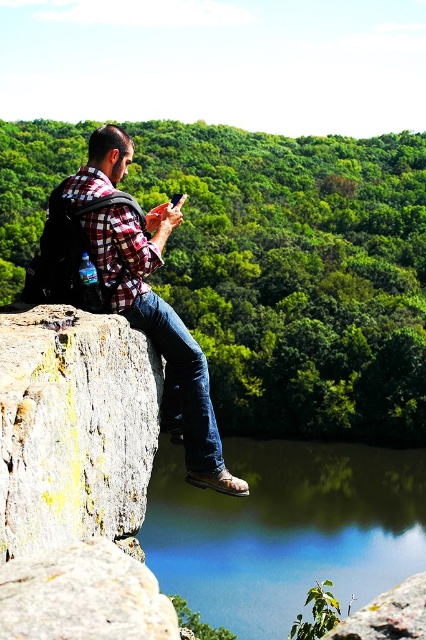
Question: Among these objects, which one is farthest from the camera?

Choices:
 (A) yellowish rock at left
 (B) plaid fabric shirt at left
 (C) green smooth water at lower center

Answer: (B)

Question: Considering the relative positions of green smooth water at lower center and plaid fabric shirt at left in the image provided, where is green smooth water at lower center located with respect to plaid fabric shirt at left?

Choices:
 (A) left
 (B) right

Answer: (B)

Question: Which point appears closest to the camera in this image?

Choices:
 (A) (46, 451)
 (B) (176, 204)

Answer: (A)

Question: Based on their relative distances, which object is farther from the green smooth water at lower center?

Choices:
 (A) plaid fabric shirt at left
 (B) yellowish rock at left

Answer: (A)

Question: Does green smooth water at lower center lie in front of plaid fabric shirt at left?

Choices:
 (A) no
 (B) yes

Answer: (B)

Question: Does yellowish rock at left appear on the right side of plaid fabric shirt at left?

Choices:
 (A) yes
 (B) no

Answer: (A)